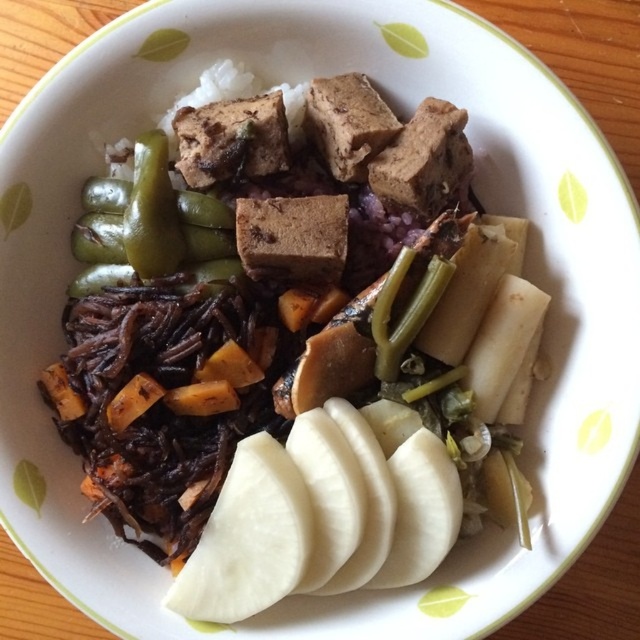
Does white matte sliced potatoes at lower center appear over green glossy pepper at upper left?

No.

Looking at this image, is white matte sliced potatoes at lower center to the left of green glossy pepper at upper left from the viewer's perspective?

In fact, white matte sliced potatoes at lower center is to the right of green glossy pepper at upper left.

Does point (381, 168) come in front of point (184, 248)?

That is True.

The image size is (640, 640). I want to click on white matte sliced potatoes at lower center, so click(292, 337).